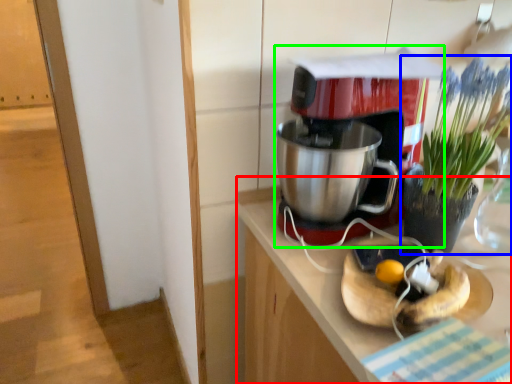
Question: Estimate the real-world distances between objects in this image. Which object is farther from counter (highlighted by a red box), houseplant (highlighted by a blue box) or coffee maker (highlighted by a green box)?

Choices:
 (A) houseplant
 (B) coffee maker

Answer: (A)